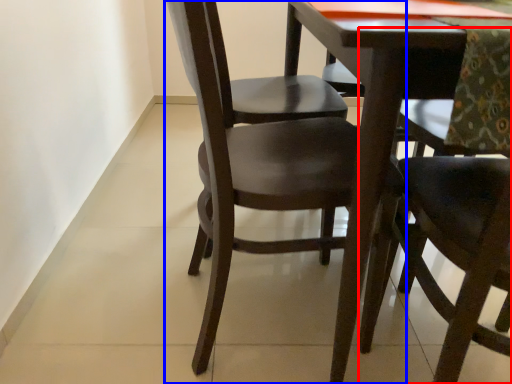
Question: Which of the following is the farthest to the observer, chair (highlighted by a red box) or chair (highlighted by a blue box)?

Choices:
 (A) chair
 (B) chair

Answer: (B)